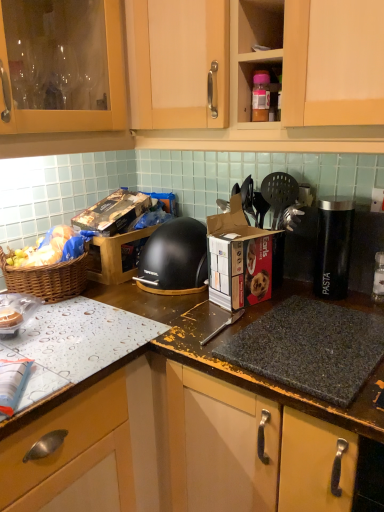
In order to click on granite gray gas stove at center in this screenshot , I will do `click(310, 348)`.

Describe the element at coordinates (260, 96) in the screenshot. I see `pink plastic bottle at upper center` at that location.

What is the approximate width of black plastic canister at right?

3.97 inches.

The width and height of the screenshot is (384, 512). In order to click on black cardboard box at center, which appears as the 1th cardboard box when viewed from the left in this screenshot , I will do tap(115, 234).

What do you see at coordinates (47, 279) in the screenshot? I see `woven brown picnic basket at left` at bounding box center [47, 279].

What do you see at coordinates (279, 194) in the screenshot? I see `black plastic spatula at upper right` at bounding box center [279, 194].

This screenshot has height=512, width=384. I want to click on granite gray gas stove at center, so click(310, 348).

Does cardboard box at center, arranged as the 1th cardboard box when viewed from the front, have a greater width compared to granite at center?

No, cardboard box at center, arranged as the 1th cardboard box when viewed from the front, is not wider than granite at center.

Consider the image. Could you measure the distance between cardboard box at center, which appears as the first cardboard box when viewed from the right, and granite at center?

The distance of cardboard box at center, which appears as the first cardboard box when viewed from the right, from granite at center is 12.47 inches.

Is cardboard box at center, which appears as the first cardboard box when viewed from the right, in front of or behind granite at center in the image?

In the image, cardboard box at center, which appears as the first cardboard box when viewed from the right, appears behind granite at center.

Is cardboard box at center, which appears as the first cardboard box when viewed from the right, at the left side of granite at center?

Correct, you'll find cardboard box at center, which appears as the first cardboard box when viewed from the right, to the left of granite at center.

From the image's perspective, would you say black cardboard box at center, which appears as the 1th cardboard box when viewed from the left, is positioned over brown woven basket at left?

Yes, from the image's perspective, black cardboard box at center, which appears as the 1th cardboard box when viewed from the left, is over brown woven basket at left.

Is black cardboard box at center, which appears as the 1th cardboard box when viewed from the left, not near brown woven basket at left?

No, black cardboard box at center, which appears as the 1th cardboard box when viewed from the left, is not far from brown woven basket at left.

Which is more to the left, black cardboard box at center, which appears as the 1th cardboard box when viewed from the left, or brown woven basket at left?

From the viewer's perspective, brown woven basket at left appears more on the left side.

Visually, is black plastic spatula at upper right positioned to the left or to the right of black cardboard box at center, acting as the second cardboard box starting from the right?

black plastic spatula at upper right is positioned on black cardboard box at center, acting as the second cardboard box starting from the right,'s right side.

Does black plastic spatula at upper right have a lesser width compared to black cardboard box at center, the second cardboard box when ordered from front to back?

Indeed, black plastic spatula at upper right has a lesser width compared to black cardboard box at center, the second cardboard box when ordered from front to back.

In terms of height, does black plastic spatula at upper right look taller or shorter compared to black cardboard box at center, the second cardboard box when ordered from front to back?

In the image, black plastic spatula at upper right appears to be taller than black cardboard box at center, the second cardboard box when ordered from front to back.

Is black plastic spatula at upper right far away from black cardboard box at center, acting as the second cardboard box starting from the right?

They are positioned close to each other.

Is matte wood cabinet at upper center positioned beyond the bounds of black plastic spatula at upper right?

Absolutely, matte wood cabinet at upper center is external to black plastic spatula at upper right.

From the image's perspective, is matte wood cabinet at upper center located above black plastic spatula at upper right?

Indeed, from the image's perspective, matte wood cabinet at upper center is shown above black plastic spatula at upper right.

Are matte wood cabinet at upper center and black plastic spatula at upper right far apart?

That's not correct — matte wood cabinet at upper center is a little close to black plastic spatula at upper right.

Considering the sizes of matte wood cabinet at upper center and black plastic spatula at upper right in the image, is matte wood cabinet at upper center wider or thinner than black plastic spatula at upper right?

matte wood cabinet at upper center is wider than black plastic spatula at upper right.

How different are the orientations of granite gray gas stove at center and black cardboard box at center, marked as the first cardboard box in a back-to-front arrangement, in degrees?

89.2 degrees separate the facing orientations of granite gray gas stove at center and black cardboard box at center, marked as the first cardboard box in a back-to-front arrangement.

Is granite gray gas stove at center beside black cardboard box at center, which appears as the 1th cardboard box when viewed from the left?

No.

Considering the relative sizes of granite gray gas stove at center and black cardboard box at center, acting as the second cardboard box starting from the right, in the image provided, is granite gray gas stove at center thinner than black cardboard box at center, acting as the second cardboard box starting from the right,?

In fact, granite gray gas stove at center might be wider than black cardboard box at center, acting as the second cardboard box starting from the right.

Can you confirm if granite gray gas stove at center is taller than black cardboard box at center, marked as the first cardboard box in a back-to-front arrangement?

In fact, granite gray gas stove at center may be shorter than black cardboard box at center, marked as the first cardboard box in a back-to-front arrangement.

Is cardboard box at center, arranged as the 1th cardboard box when viewed from the front, spatially inside granite gray gas stove at center, or outside of it?

cardboard box at center, arranged as the 1th cardboard box when viewed from the front, is not inside granite gray gas stove at center, it's outside.

Is cardboard box at center, arranged as the 1th cardboard box when viewed from the front, taller than granite gray gas stove at center?

Correct, cardboard box at center, arranged as the 1th cardboard box when viewed from the front, is much taller as granite gray gas stove at center.

From the image's perspective, which object appears higher, cardboard box at center, arranged as the 1th cardboard box when viewed from the front, or granite gray gas stove at center?

cardboard box at center, arranged as the 1th cardboard box when viewed from the front.

From a real-world perspective, is cardboard box at center, which appears as the first cardboard box when viewed from the right, located higher than granite gray gas stove at center?

Yes.

In the scene shown: How many degrees apart are the facing directions of matte wood cabinet at upper center and granite gray gas stove at center?

The angular difference between matte wood cabinet at upper center and granite gray gas stove at center is 1.29 degrees.

Is matte wood cabinet at upper center turned away from granite gray gas stove at center?

No, granite gray gas stove at center is not at the back of matte wood cabinet at upper center.

Which is closer, (x=166, y=145) or (x=296, y=339)?

Point (x=166, y=145) is farther from the camera than point (x=296, y=339).

From a real-world perspective, who is located lower, matte wood cabinet at upper center or granite gray gas stove at center?

granite gray gas stove at center.

At what (x,y) coordinates should I click in order to perform the action: click on countertop that is below the cardboard box at center, which appears as the first cardboard box when viewed from the right (from the image's perspective). Please return your answer as a coordinate pair (x, y). Looking at the image, I should click on (185, 437).

The width and height of the screenshot is (384, 512). I want to click on food in front of the black cardboard box at center, acting as the second cardboard box starting from the right, so click(x=49, y=249).

Which object lies further to the anchor point matte wood cabinet at upper center, cardboard box at center, acting as the second cardboard box starting from the back, or pink plastic bottle at upper center?

cardboard box at center, acting as the second cardboard box starting from the back.

From the image, which object appears to be nearer to black plastic spatula at upper right, pink plastic bottle at upper center or woven brown picnic basket at left?

Based on the image, pink plastic bottle at upper center appears to be nearer to black plastic spatula at upper right.

From the image, which object appears to be nearer to pink plastic bottle at upper center, black matte food processor at center or granite gray gas stove at center?

Based on the image, black matte food processor at center appears to be nearer to pink plastic bottle at upper center.

Based on their spatial positions, is black plastic canister at right or black plastic spatula at upper right further from granite at center?

black plastic spatula at upper right lies further to granite at center than the other object.

Which object lies further to the anchor point cardboard box at center, which ranks as the 2th cardboard box in left-to-right order, black matte food processor at center or pink plastic bottle at upper center?

pink plastic bottle at upper center lies further to cardboard box at center, which ranks as the 2th cardboard box in left-to-right order, than the other object.

Considering their positions, is black cardboard box at center, which appears as the 1th cardboard box when viewed from the left, positioned closer to cardboard box at center, arranged as the 1th cardboard box when viewed from the front, than granite gray gas stove at center?

granite gray gas stove at center.

From the image, which object appears to be farther from black matte food processor at center, matte wood cabinet at upper center or granite at center?

matte wood cabinet at upper center lies further to black matte food processor at center than the other object.

When comparing their distances from brown woven basket at left, does black matte food processor at center or cardboard box at center, which ranks as the 2th cardboard box in left-to-right order, seem further?

cardboard box at center, which ranks as the 2th cardboard box in left-to-right order, lies further to brown woven basket at left than the other object.

The height and width of the screenshot is (512, 384). Identify the location of bottle situated between brown woven basket at left and black plastic spatula at upper right from left to right. (260, 96).

The image size is (384, 512). I want to click on kitchen appliance between pink plastic bottle at upper center and granite at center in the up-down direction, so click(x=175, y=258).

The image size is (384, 512). I want to click on kitchen appliance between black plastic canister at right and granite at center from top to bottom, so click(175, 258).

You are a GUI agent. You are given a task and a screenshot of the screen. Output one action in this format:
    pyautogui.click(x=<x>, y=<y>)
    Task: Click on the cabinetry between brown woven basket at left and black plastic spatula at upper right in the horizontal direction
    
    Given the screenshot: What is the action you would take?
    pyautogui.click(x=283, y=88)